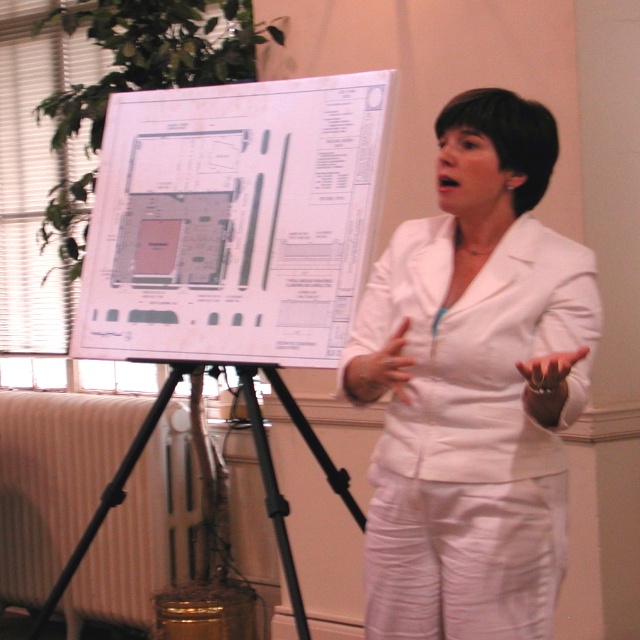
Question: Can you confirm if white matte blazer at center is positioned below black matte tripod at center?

Choices:
 (A) no
 (B) yes

Answer: (A)

Question: Is white paper at center thinner than black matte tripod at center?

Choices:
 (A) no
 (B) yes

Answer: (B)

Question: Which of the following is the closest to the observer?

Choices:
 (A) white paper at center
 (B) white matte blazer at center
 (C) black matte tripod at center

Answer: (B)

Question: Which point is closer to the camera?

Choices:
 (A) white paper at center
 (B) black matte tripod at center

Answer: (B)

Question: Which object is the farthest from the white matte blazer at center?

Choices:
 (A) black matte tripod at center
 (B) white paper at center

Answer: (B)

Question: Is white matte blazer at center to the right of white paper at center from the viewer's perspective?

Choices:
 (A) no
 (B) yes

Answer: (B)